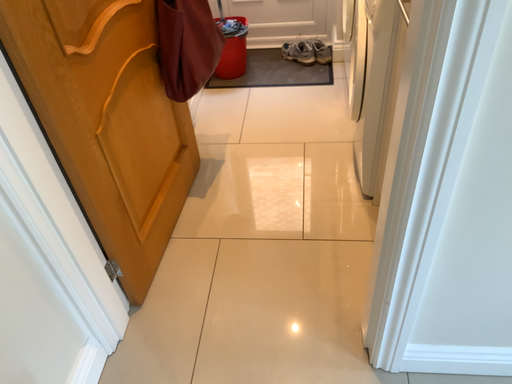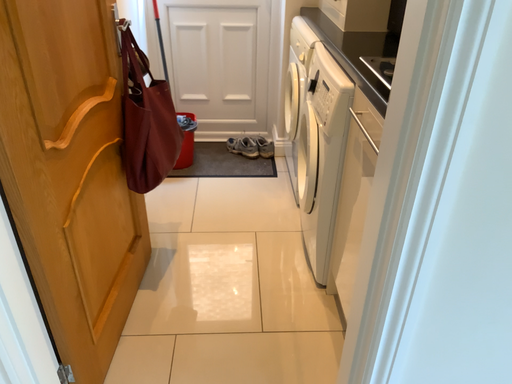
Question: Which way did the camera rotate in the video?

Choices:
 (A) rotated upward
 (B) rotated downward

Answer: (A)